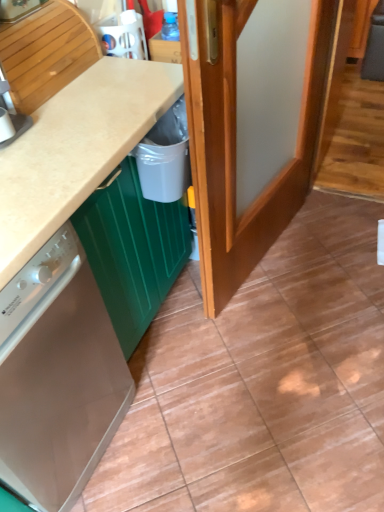
At what (x,y) coordinates should I click in order to perform the action: click on free point below white plastic bin at lower center (from a real-world perspective). Please return your answer as a coordinate pair (x, y). This screenshot has width=384, height=512. Looking at the image, I should click on (193, 305).